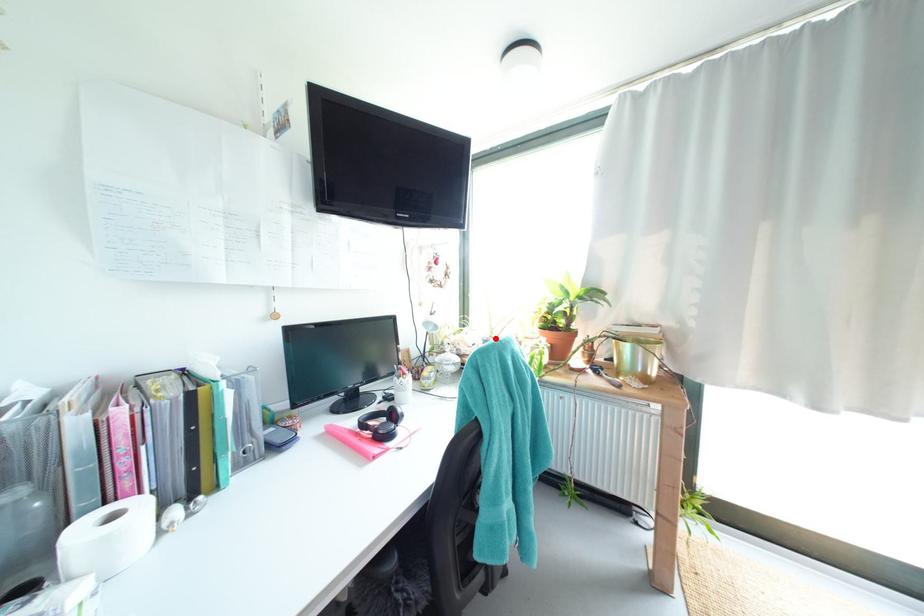
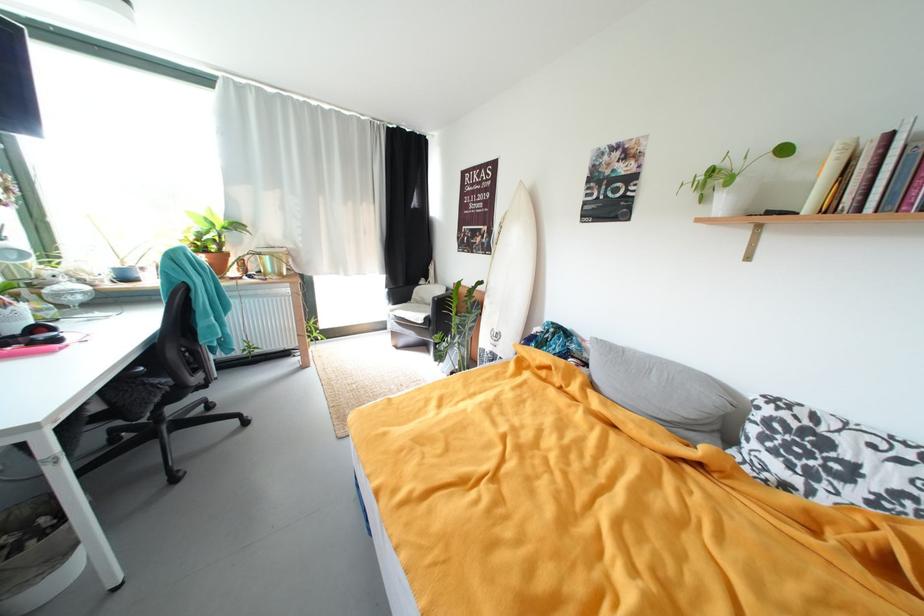
The point at the highlighted location is marked in the first image. Where is the corresponding point in the second image?

(127, 268)